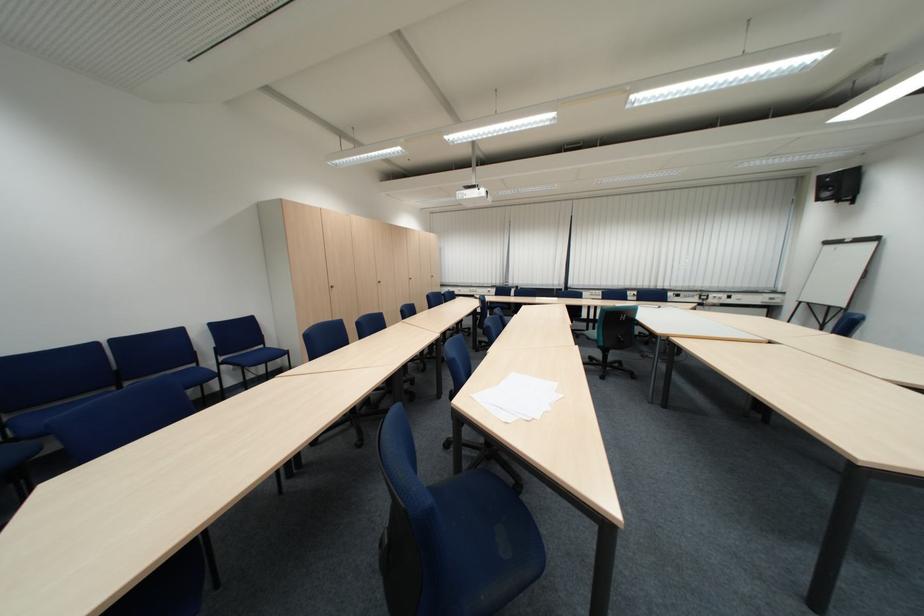
Where would you sit the blue chair sitting surface? Please return your answer as a coordinate pair (x, y).

(495, 517)